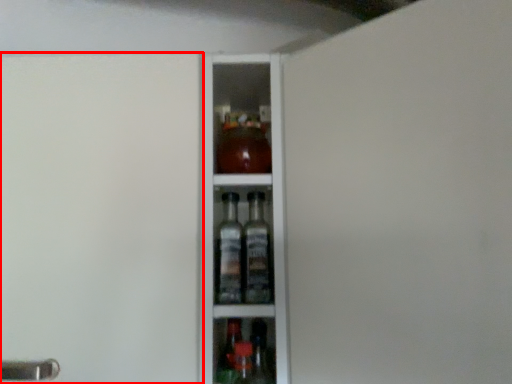
Question: From the image's perspective, where is screen door (annotated by the red box) located in relation to screen door in the image?

Choices:
 (A) below
 (B) above

Answer: (A)